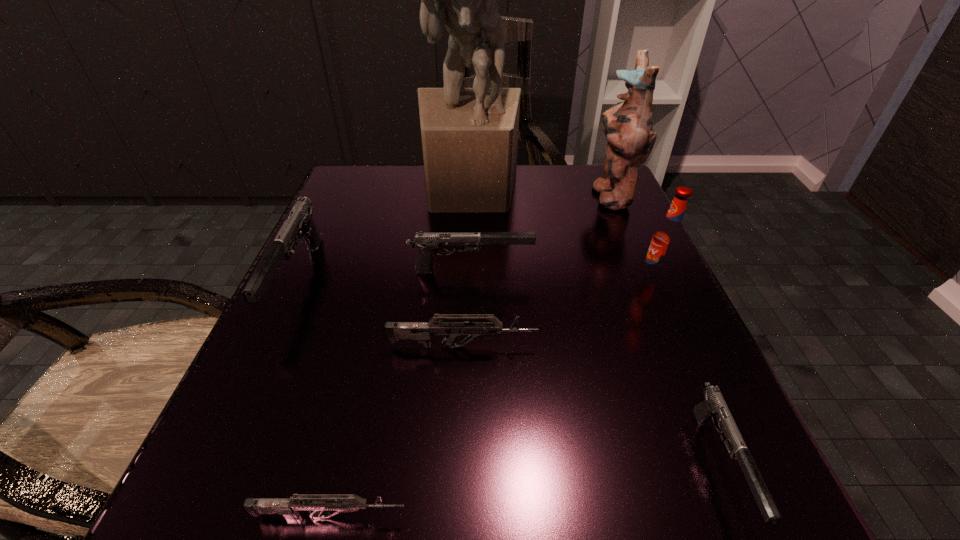
Locate an element on the screen. The height and width of the screenshot is (540, 960). unoccupied position between the gray sculpture and the second gray gun from left to right is located at coordinates (470, 228).

Where is `free area in between the root beer and the fourth shortest gun`? The width and height of the screenshot is (960, 540). free area in between the root beer and the fourth shortest gun is located at coordinates (564, 274).

Find the location of a particular element. This screenshot has height=540, width=960. vacant space that's between the gray sculpture and the pink figurine is located at coordinates (540, 191).

The height and width of the screenshot is (540, 960). Find the location of `object that stands as the seventh closest to the nearest gray gun`. object that stands as the seventh closest to the nearest gray gun is located at coordinates (300, 223).

Identify which object is located as the fourth nearest to the second tallest object. Please provide its 2D coordinates. Your answer should be formatted as a tuple, i.e. [(x, y)], where the tuple contains the x and y coordinates of a point satisfying the conditions above.

[(421, 331)]

Identify which gun is the third closest to the red root beer. Please provide its 2D coordinates. Your answer should be formatted as a tuple, i.e. [(x, y)], where the tuple contains the x and y coordinates of a point satisfying the conditions above.

[(421, 331)]

Select which gun is the second closest to the leftmost object. Please provide its 2D coordinates. Your answer should be formatted as a tuple, i.e. [(x, y)], where the tuple contains the x and y coordinates of a point satisfying the conditions above.

[(426, 243)]

Find the location of `the second closest gray gun to the biggest gray gun`. the second closest gray gun to the biggest gray gun is located at coordinates (714, 407).

This screenshot has height=540, width=960. Identify the location of gray gun that is the second closest to the shortest gun. (714, 407).

Identify the location of free space that satisfies the following two spatial constraints: 1. on the back side of the third tallest object; 2. at the muzzle end of the second smallest gray gun. (651, 270).